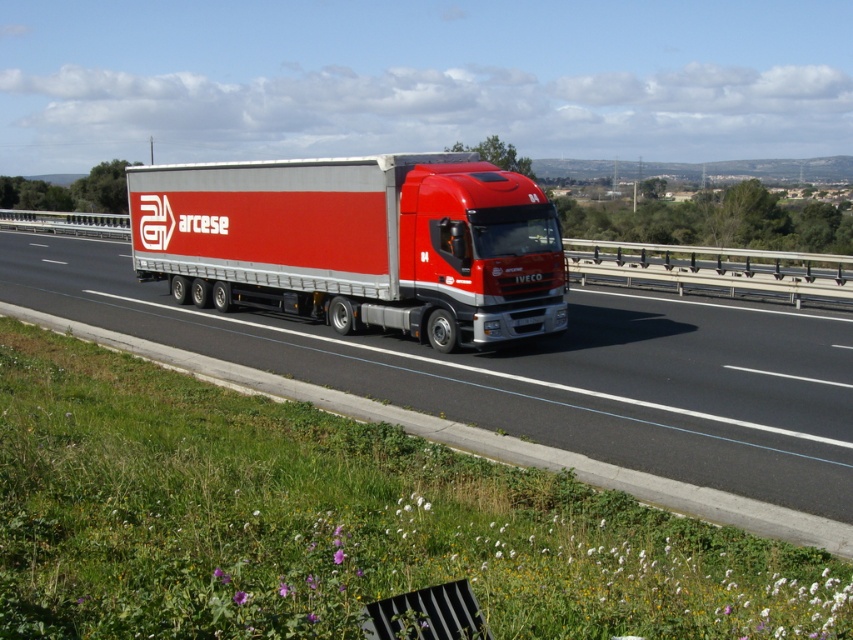
You are a traffic monitoring system analyzing the image. The system uses a coordinate system where the bottom left corner of the image is the origin point. The truck is located at a specific coordinate. What is the 2D coordinate of the metallic silver truck at center?

The 2D coordinate of the metallic silver truck at center is at point (x=537, y=372).

You are a traffic officer assessing the width of vehicles on a highway. You observe a metallic silver truck at center and a metallic silver trailer truck at center. Which vehicle has a greater width according to the description?

The metallic silver truck at center might be wider than metallic silver trailer truck at center according to the description.

You are a delivery driver who needs to enter a tunnel with a height restriction of 4 meters. The tunnel allows vehicles up to 4 meters tall. You observe the metallic silver truck at center and the metallic silver trailer truck at center in the image. Which vehicle is more likely to exceed the height limit?

The metallic silver trailer truck at center is taller than the metallic silver truck at center, so the metallic silver trailer truck at center is more likely to exceed the height limit if its height is over 4 meters.